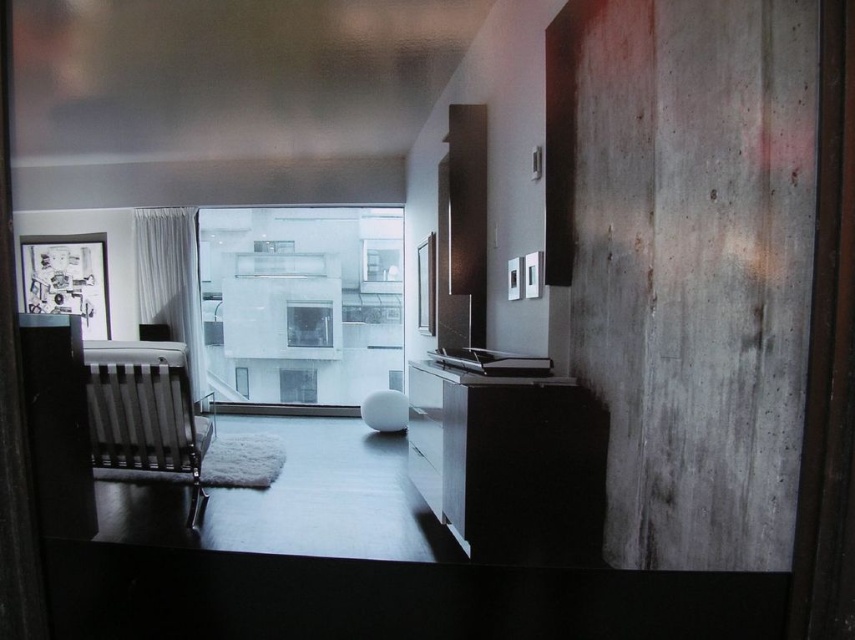
Question: Is matte black cabinet at left thinner than transparent glass window at center?

Choices:
 (A) no
 (B) yes

Answer: (A)

Question: Which point is farther to the camera?

Choices:
 (A) black textured rocking chair at left
 (B) matte black cabinet at left

Answer: (B)

Question: Which point is farther to the camera?

Choices:
 (A) (32, 356)
 (B) (329, 244)

Answer: (A)

Question: Is transparent glass door at center below transparent glass window at center?

Choices:
 (A) yes
 (B) no

Answer: (B)

Question: Is transparent glass door at center to the left of matte black cabinet at left from the viewer's perspective?

Choices:
 (A) no
 (B) yes

Answer: (A)

Question: Which point is farther from the camera taking this photo?

Choices:
 (A) (290, 305)
 (B) (181, 419)
 (C) (55, 492)
 (D) (249, 340)

Answer: (B)